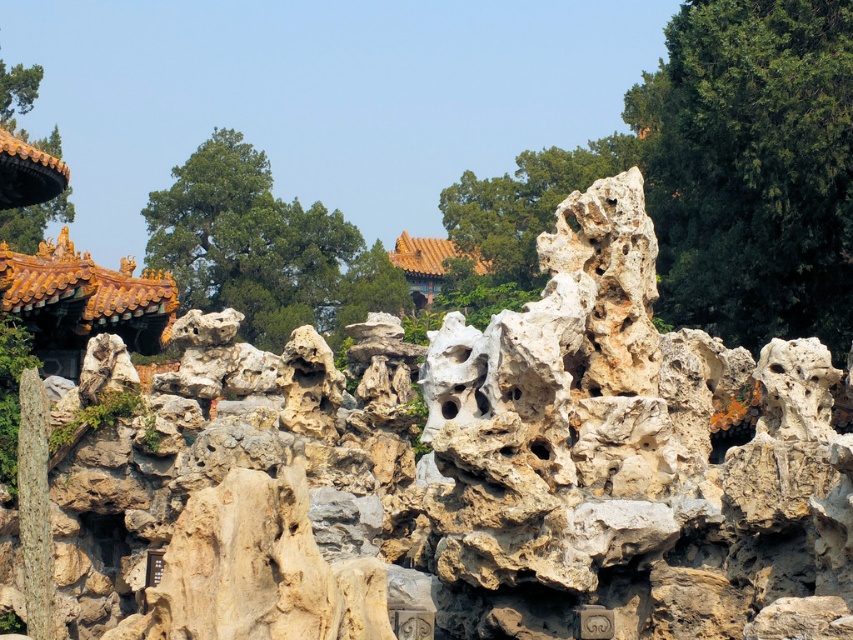
Question: Which is farther from the green leafy tree at upper right?

Choices:
 (A) yellow glazed tile palace at upper center
 (B) natural stone rock formation at center
 (C) smooth stone rock at center
 (D) green leafy tree at center

Answer: (A)

Question: Which point is closer to the camera?

Choices:
 (A) (840, 74)
 (B) (772, 502)
 (C) (36, 80)
 (D) (430, 266)

Answer: (B)

Question: Which object is positioned farthest from the green leafy tree at upper left?

Choices:
 (A) yellow glazed tile palace at upper center
 (B) smooth stone rock at center
 (C) natural stone rock formation at center
 (D) green leafy tree at upper right

Answer: (C)

Question: Does green leafy tree at center have a smaller size compared to smooth stone rock at center?

Choices:
 (A) yes
 (B) no

Answer: (B)

Question: Can you confirm if green leafy tree at center is thinner than yellow glazed tile palace at upper center?

Choices:
 (A) no
 (B) yes

Answer: (A)

Question: Does green leafy tree at center have a larger size compared to smooth stone rock at center?

Choices:
 (A) yes
 (B) no

Answer: (A)